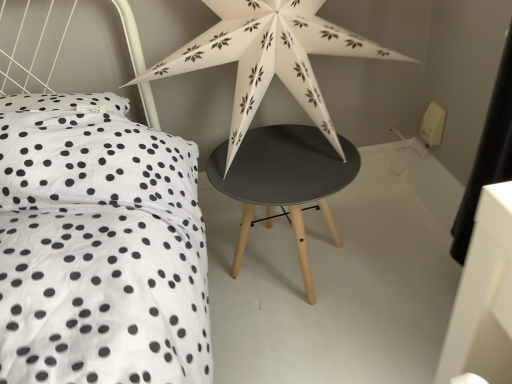
Question: Is white paper star at upper center behind matte black stool at center?

Choices:
 (A) no
 (B) yes

Answer: (A)

Question: From a real-world perspective, is white paper star at upper center over matte black stool at center?

Choices:
 (A) yes
 (B) no

Answer: (A)

Question: From a real-world perspective, is white paper star at upper center below matte black stool at center?

Choices:
 (A) no
 (B) yes

Answer: (A)

Question: Can you see white paper star at upper center touching matte black stool at center?

Choices:
 (A) no
 (B) yes

Answer: (A)

Question: Is white paper star at upper center completely or partially outside of matte black stool at center?

Choices:
 (A) yes
 (B) no

Answer: (A)

Question: Considering the relative sizes of white paper star at upper center and matte black stool at center in the image provided, is white paper star at upper center wider than matte black stool at center?

Choices:
 (A) no
 (B) yes

Answer: (A)

Question: Considering the relative sizes of matte black stool at center and white paper star at upper center in the image provided, is matte black stool at center thinner than white paper star at upper center?

Choices:
 (A) no
 (B) yes

Answer: (A)

Question: Does matte black stool at center lie in front of white paper star at upper center?

Choices:
 (A) no
 (B) yes

Answer: (A)

Question: Is matte black stool at center positioned behind white paper star at upper center?

Choices:
 (A) no
 (B) yes

Answer: (B)

Question: Is matte black stool at center taller than white paper star at upper center?

Choices:
 (A) yes
 (B) no

Answer: (B)

Question: Does matte black stool at center appear on the left side of white paper star at upper center?

Choices:
 (A) no
 (B) yes

Answer: (A)

Question: Is white paper star at upper center at the back of matte black stool at center?

Choices:
 (A) no
 (B) yes

Answer: (A)

Question: In terms of height, does white paper star at upper center look taller or shorter compared to matte black stool at center?

Choices:
 (A) tall
 (B) short

Answer: (A)